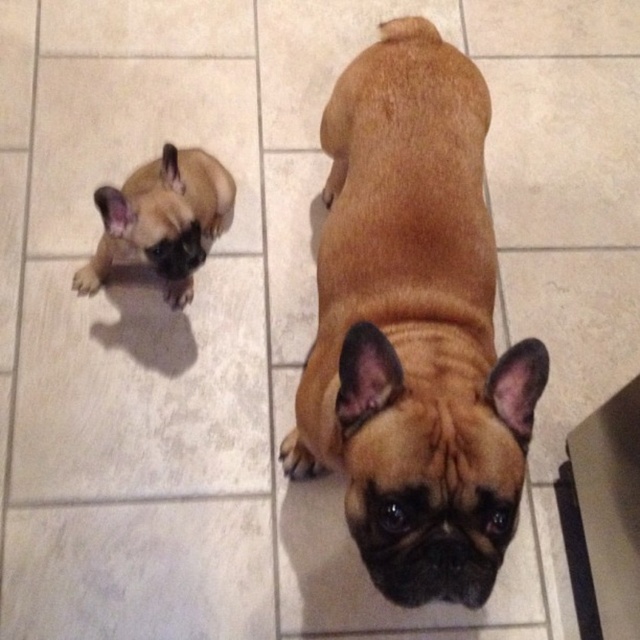
You are a photographer setting up a shoot in this scene. You want to ensure both the brown matte dog at center and the brown matte french bulldog at upper left are fully visible in the frame. Given their positions, which dog should you adjust the camera angle to focus on first to maintain both in the shot?

The brown matte dog at center is in front of the brown matte french bulldog at upper left. To ensure both are fully visible, focus on the brown matte dog at center first, as it is closer to the camera and adjusting the angle to include it will naturally keep the one behind in view as well.

You are a photographer setting up a shoot for a pet magazine. You need to ensure that both the brown matte dog at center and the brown matte french bulldog at upper left are fully visible in the frame. Based on their positions, which dog is closer to the camera and might block the view of the other?

The brown matte dog at center is positioned under the brown matte french bulldog at upper left, so the brown matte french bulldog at upper left is closer to the camera and might block the view of the brown matte dog at center.

You are standing in the room where the two French Bulldogs are. You want to place a small treat exactly at point (413, 326). Which dog should you target to ensure the treat lands on it?

The point (413, 326) is on the brown matte dog at center, so you should target the brown matte dog at center to place the treat there.